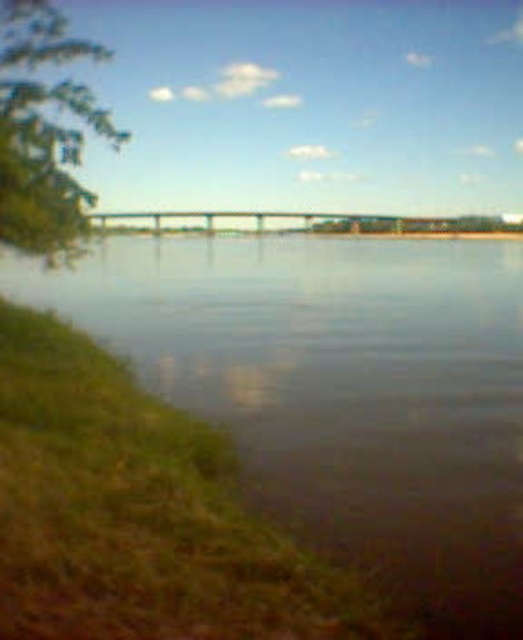
You are standing at the point marked as point (475,292) in the riverside scene. You want to throw a pebble into the river to create a ripple. If the pebble can travel 25 meters, will it reach the water?

The distance between you and the viewer is 27.19 meters, which is greater than the pebble can travel 25 meters. Therefore, the pebble will not reach the water.

You are standing at the center of the image and want to locate the brown reflective water at center. According to the coordinates provided, in which direction should you look to find it?

The brown reflective water at center is located at coordinates point (339, 388). Since you are at the center, looking towards the direction corresponding to these coordinates would be the correct path.